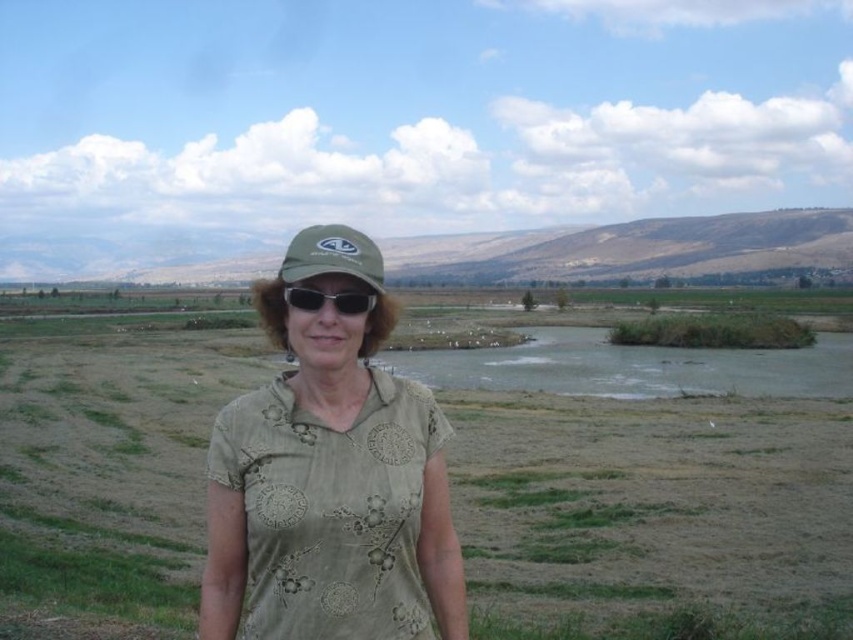
Question: Which object is farther from the camera taking this photo?

Choices:
 (A) green fabric shirt at center
 (B) green fabric baseball cap at center

Answer: (B)

Question: Can you confirm if green fabric shirt at center is smaller than black matte sunglasses at center?

Choices:
 (A) yes
 (B) no

Answer: (B)

Question: Which object is the closest to the black matte sunglasses at center?

Choices:
 (A) green fabric baseball cap at center
 (B) green fabric shirt at center

Answer: (A)

Question: Can you confirm if green fabric shirt at center is positioned above black matte sunglasses at center?

Choices:
 (A) no
 (B) yes

Answer: (A)

Question: Is green fabric baseball cap at center smaller than black matte sunglasses at center?

Choices:
 (A) yes
 (B) no

Answer: (B)

Question: Which point is farther to the camera?

Choices:
 (A) black matte sunglasses at center
 (B) green fabric baseball cap at center
 (C) green fabric shirt at center

Answer: (A)